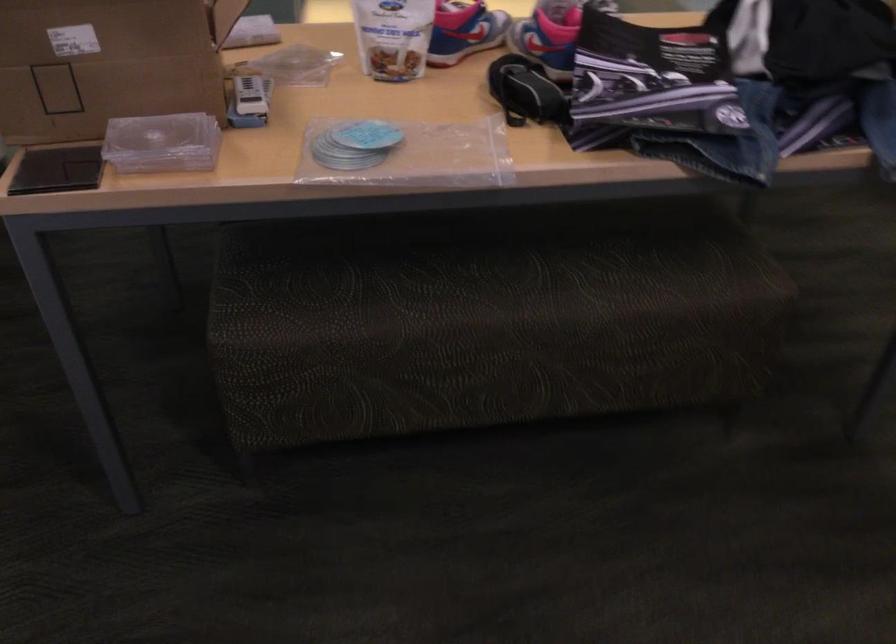
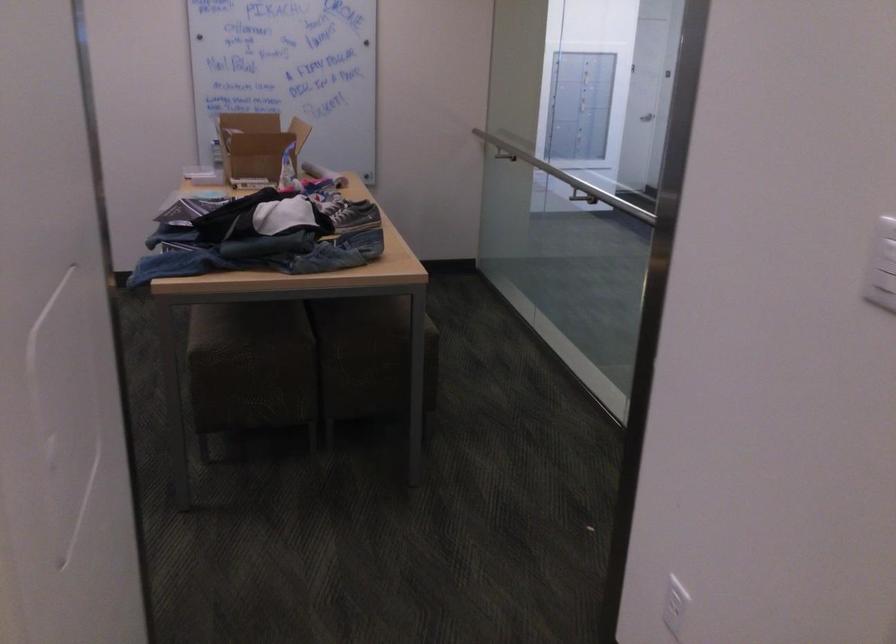
Question: I am providing you with two images of the same scene from different viewpoints. Which of the following objects are not visible in image2?

Choices:
 (A) clear CD case
 (B) stool sitting surface
 (C) gray sneaker
 (D) black flashlight

Answer: (A)